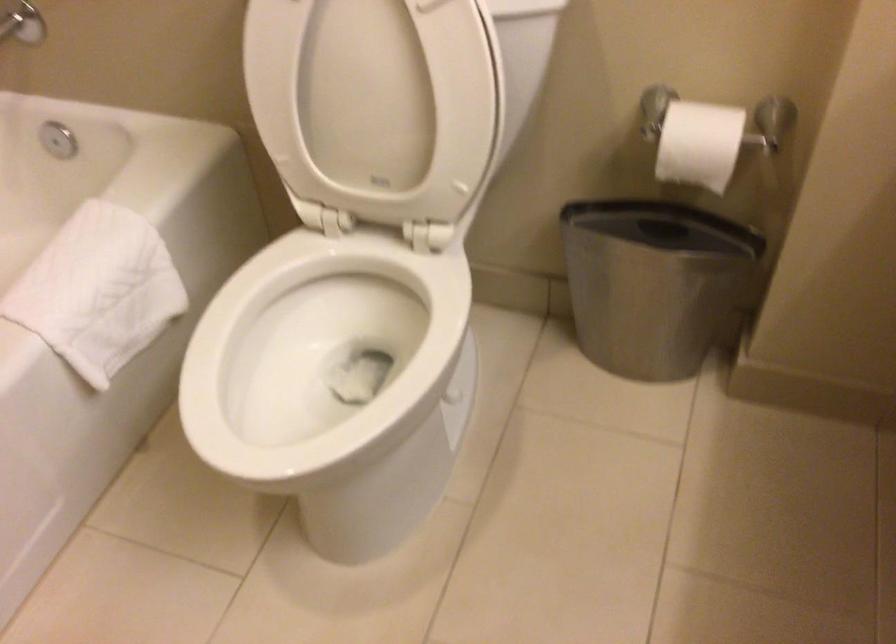
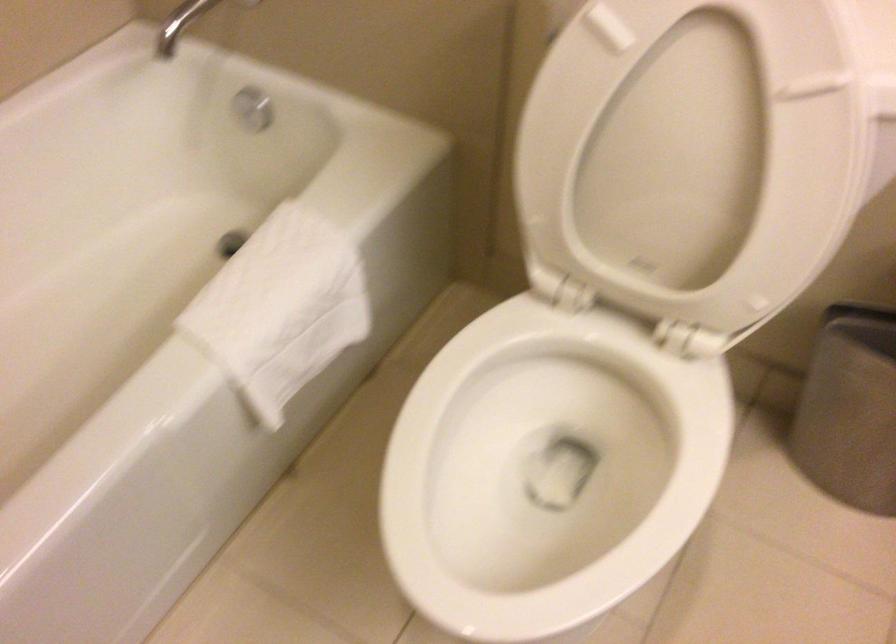
Question: I am providing you with two images of the same scene from different viewpoints. After the viewpoint changes to image2, which objects are now occluded?

Choices:
 (A) small trash can
 (B) white bath mat
 (C) white toilet seat
 (D) none of these

Answer: (D)